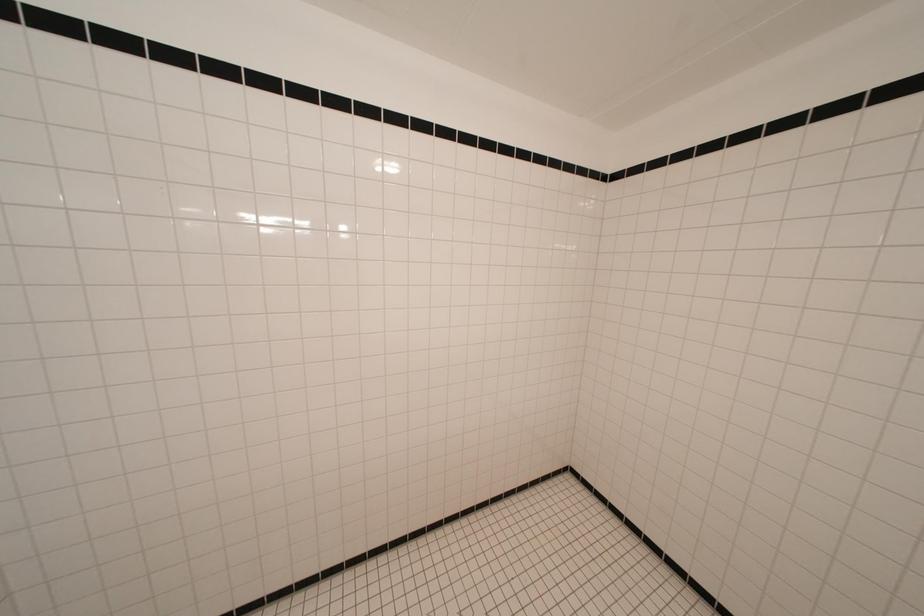
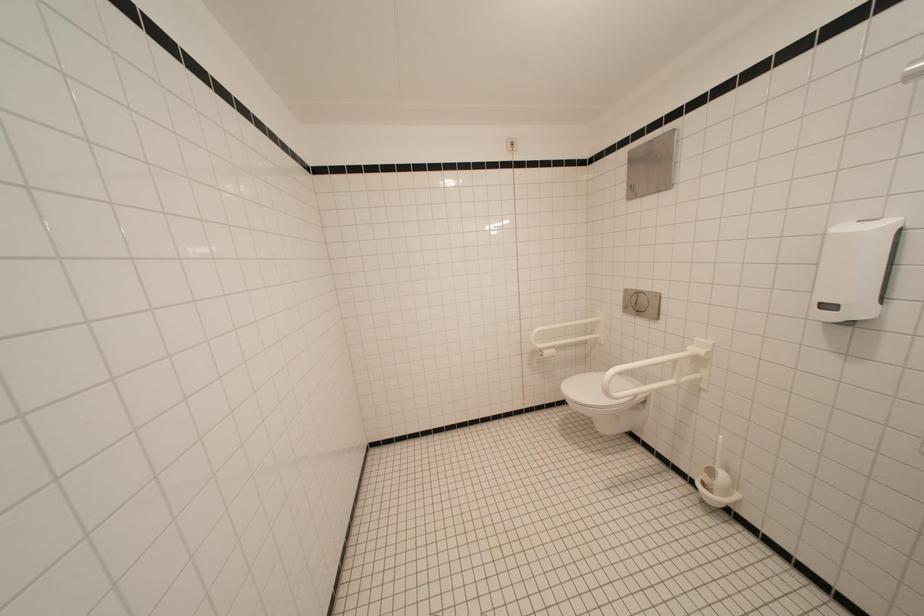
Question: The camera is either moving clockwise (left) or counter-clockwise (right) around the object. The first image is from the beginning of the video and the second image is from the end. Is the camera moving left or right when shooting the video?

Choices:
 (A) Left
 (B) Right

Answer: (A)